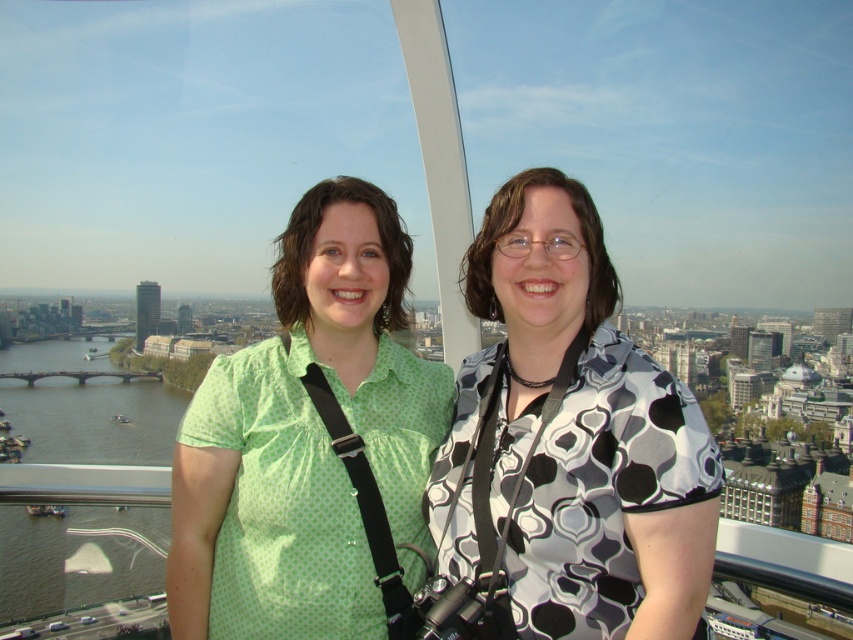
From the picture: Which is more to the left, black and white patterned shirt at center or green water at lower left?

From the viewer's perspective, green water at lower left appears more on the left side.

Is black and white patterned shirt at center to the right of green water at lower left from the viewer's perspective?

Yes, black and white patterned shirt at center is to the right of green water at lower left.

Which is behind, point (579, 616) or point (160, 451)?

Point (160, 451)

Where is `black and white patterned shirt at center`? The image size is (853, 640). black and white patterned shirt at center is located at coordinates [572, 436].

This screenshot has height=640, width=853. What do you see at coordinates (306, 438) in the screenshot? I see `green dotted shirt at center` at bounding box center [306, 438].

Between point (343, 353) and point (143, 292), which one is positioned behind?

Point (143, 292)

Image resolution: width=853 pixels, height=640 pixels. What are the coordinates of `green dotted shirt at center` in the screenshot? It's located at (306, 438).

Can you confirm if green water at lower left is positioned to the left of smooth glass tower at center?

Incorrect, green water at lower left is not on the left side of smooth glass tower at center.

Does green water at lower left appear over smooth glass tower at center?

Incorrect, green water at lower left is not positioned above smooth glass tower at center.

Who is more distant from viewer, [12,385] or [152,330]?

The point [152,330] is more distant.

Find the location of a particular element. Image resolution: width=853 pixels, height=640 pixels. green water at lower left is located at coordinates (78, 557).